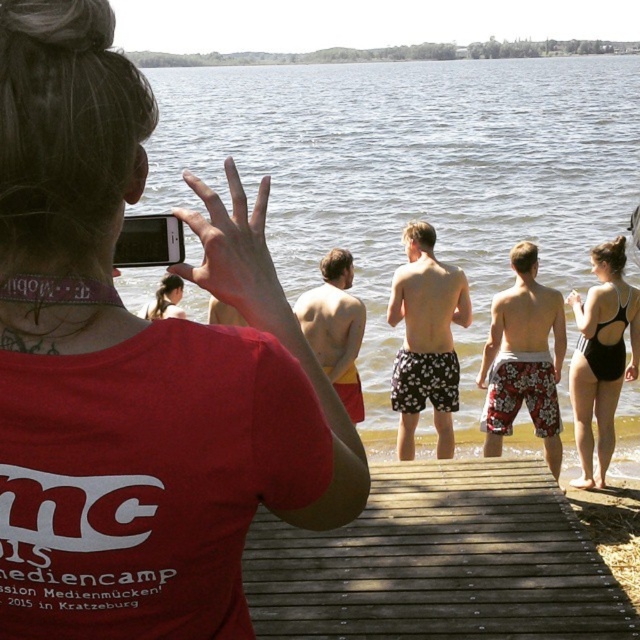
Question: Does floral-patterned shorts at center appear on the right side of black swimsuit at right?

Choices:
 (A) yes
 (B) no

Answer: (B)

Question: Can you confirm if floral-patterned shorts at center-right is thinner than black swimsuit at right?

Choices:
 (A) no
 (B) yes

Answer: (A)

Question: Estimate the real-world distances between objects in this image. Which object is closer to the black swimsuit at right?

Choices:
 (A) clear water at center
 (B) matte red t-shirt at center
 (C) floral-patterned shorts at center-right
 (D) floral-patterned shorts at center

Answer: (C)

Question: Which is nearer to the matte red t-shirt at center?

Choices:
 (A) floral-patterned shorts at center
 (B) floral-patterned shorts at center-right
 (C) smooth skin woman at center
 (D) clear water at center

Answer: (C)

Question: Is matte red t-shirt at center further to the viewer compared to clear water at center?

Choices:
 (A) no
 (B) yes

Answer: (A)

Question: Which point is farther to the camera?

Choices:
 (A) smooth skin woman at center
 (B) floral-patterned shorts at center-right
 (C) black swimsuit at right
 (D) floral-patterned shorts at center

Answer: (C)